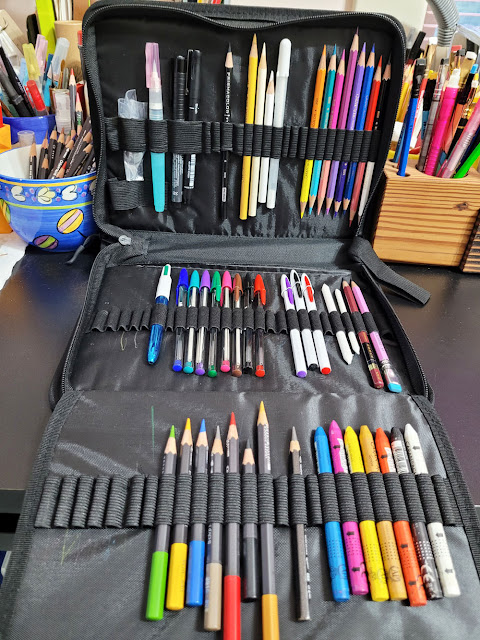
Where is `thick orange tip of the crayon pencil on the right side of the case at the bottom`? Image resolution: width=480 pixels, height=640 pixels. thick orange tip of the crayon pencil on the right side of the case at the bottom is located at coordinates (381, 429).